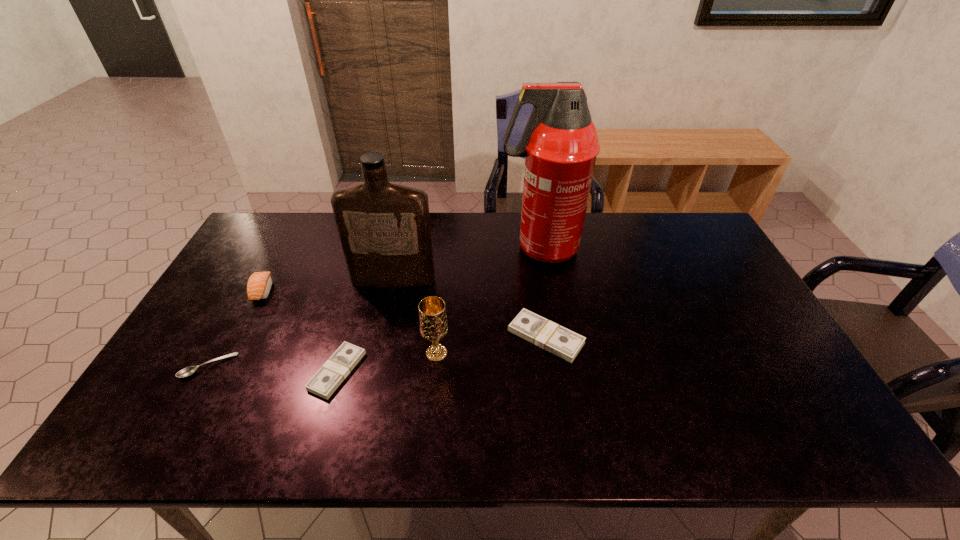
Locate an element on the screen. This screenshot has height=540, width=960. dollar that is positioned at the near edge is located at coordinates (328, 378).

Identify the location of soupspoon that is at the near edge. This screenshot has height=540, width=960. (187, 371).

You are a GUI agent. You are given a task and a screenshot of the screen. Output one action in this format:
    pyautogui.click(x=<x>, y=<y>)
    Task: Click on the sushi that is positioned at the left edge
    
    Given the screenshot: What is the action you would take?
    pyautogui.click(x=259, y=285)

Find the location of `soupspoon at the left edge`. soupspoon at the left edge is located at coordinates (187, 371).

The width and height of the screenshot is (960, 540). In order to click on object that is at the near left corner in this screenshot , I will do `click(187, 371)`.

In the image, there is a desktop. In order to click on vacant space at the far edge in this screenshot , I will do `click(321, 222)`.

Locate an element on the screen. This screenshot has height=540, width=960. free space at the near edge of the desktop is located at coordinates (715, 395).

This screenshot has height=540, width=960. In the image, there is a desktop. In order to click on vacant space at the left edge in this screenshot , I will do `click(264, 267)`.

In the image, there is a desktop. Identify the location of vacant space at the right edge. This screenshot has height=540, width=960. (717, 311).

Identify the location of vacant space at the far left corner. (268, 244).